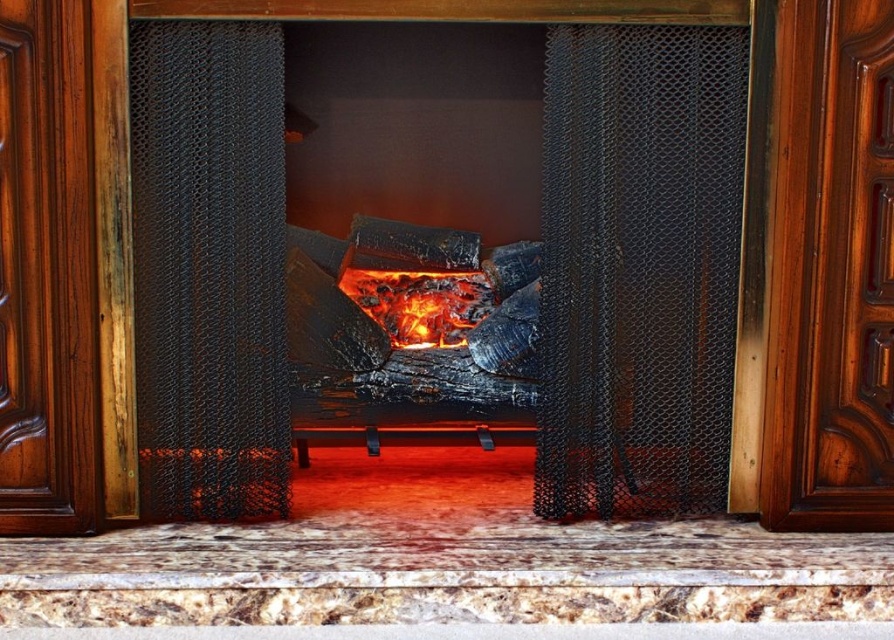
Question: Which object is the closest to the glowing embers at center?

Choices:
 (A) black mesh screen at center
 (B) metal mesh screen at center
 (C) matte black fireplace screen at center

Answer: (C)

Question: Which point is closer to the camera?

Choices:
 (A) (597, 385)
 (B) (201, 211)
 (C) (426, 307)
 (D) (204, 88)

Answer: (D)

Question: Does matte black fireplace screen at center have a lesser width compared to glowing embers at center?

Choices:
 (A) yes
 (B) no

Answer: (B)

Question: Which of these objects is positioned closest to the glowing embers at center?

Choices:
 (A) matte black fireplace screen at center
 (B) metal mesh screen at center

Answer: (A)

Question: Does metal mesh screen at center appear over glowing embers at center?

Choices:
 (A) no
 (B) yes

Answer: (B)

Question: Does matte black fireplace screen at center have a smaller size compared to metal mesh screen at center?

Choices:
 (A) no
 (B) yes

Answer: (A)